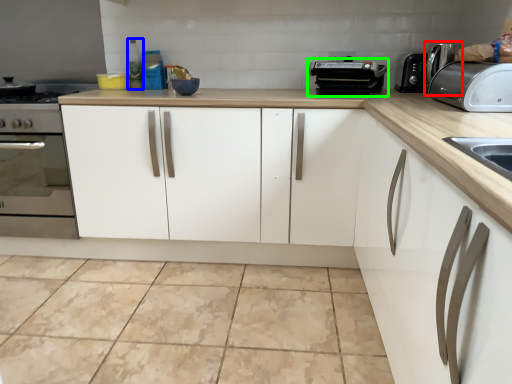
Question: Based on their relative distances, which object is farther from coffee machine (highlighted by a red box)? Choose from bottle (highlighted by a blue box) and appliance (highlighted by a green box).

Choices:
 (A) bottle
 (B) appliance

Answer: (A)